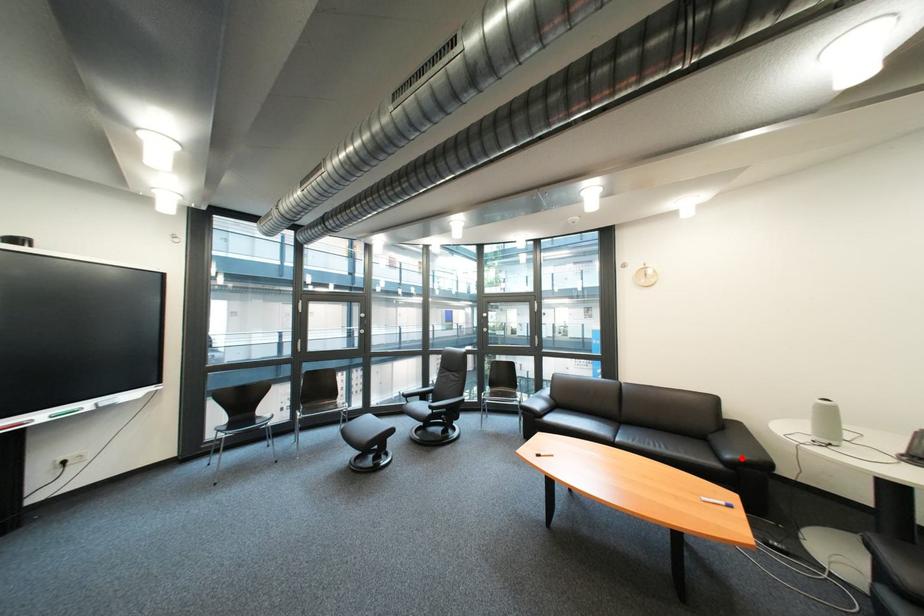
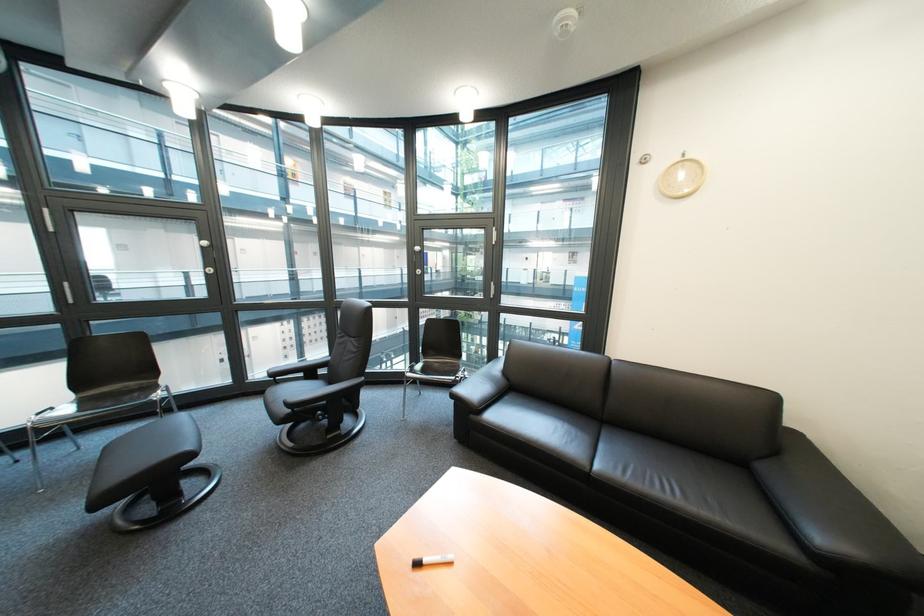
In the second image, find the point that corresponds to the highlighted location in the first image.

(833, 540)